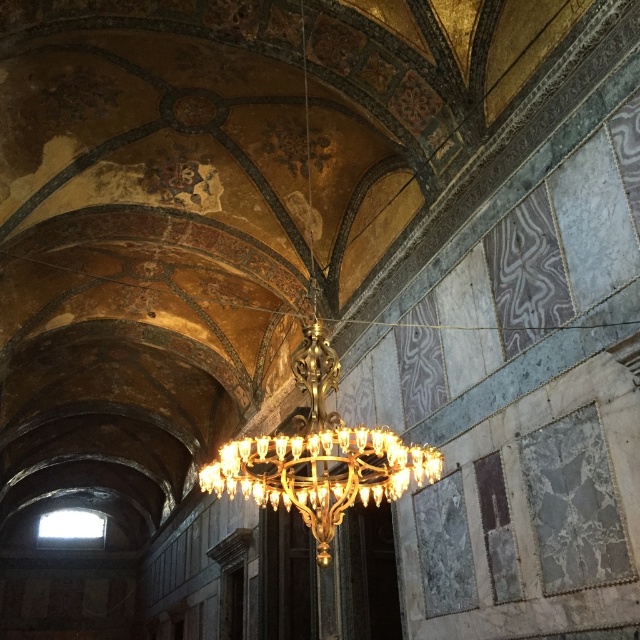
You are standing in the grand cathedral and need to locate two specific points marked on the floor plan. The first point is at coordinates point (225, 460) and the second is at point (344, 426). Which point is closer to the entrance of the cathedral?

Point (225, 460) is in front of point (344, 426), so it is closer to the entrance of the cathedral.

You are standing in the grand cathedral and want to take a closer look at the gold metallic chandelier at center. If you walk straight ahead, will you be able to get within 30 meters of it?

The gold metallic chandelier at center is 31.57 meters from viewer. Since it is more than 30 meters away, you cannot get within 30 meters of it by walking straight ahead.